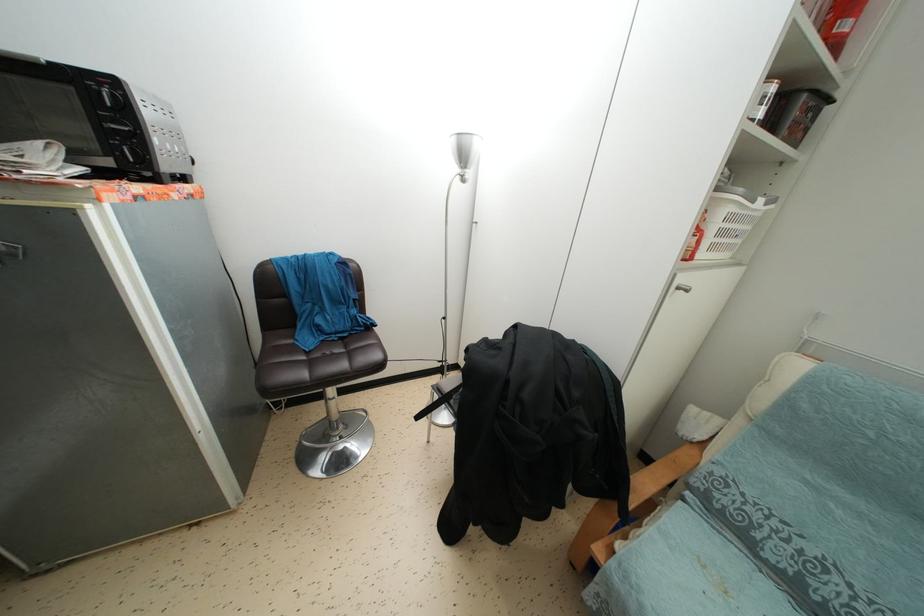
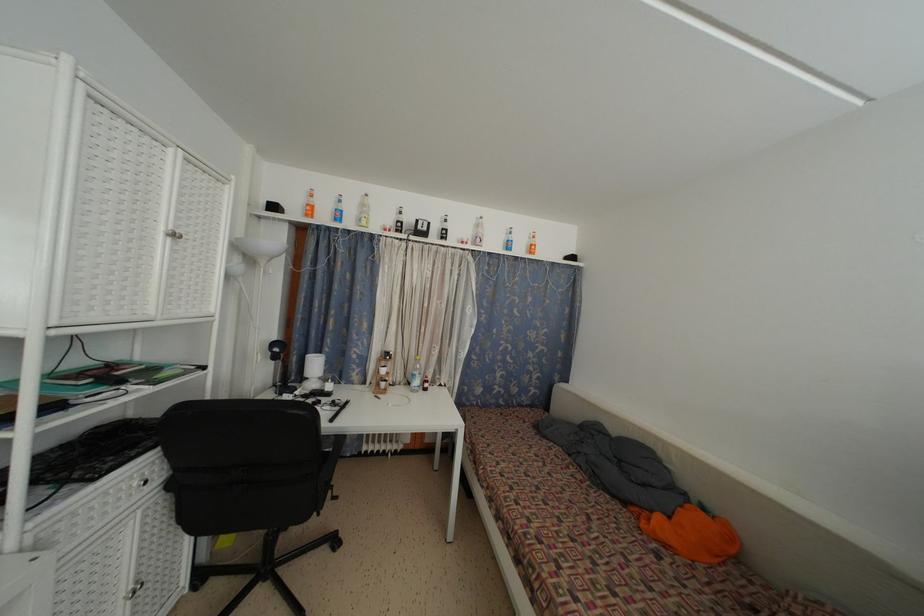
Question: Based on the continuous images, in which direction is the camera rotating? Reply with the corresponding letter.

Choices:
 (A) Left
 (B) Right
 (C) Up
 (D) Down

Answer: (A)